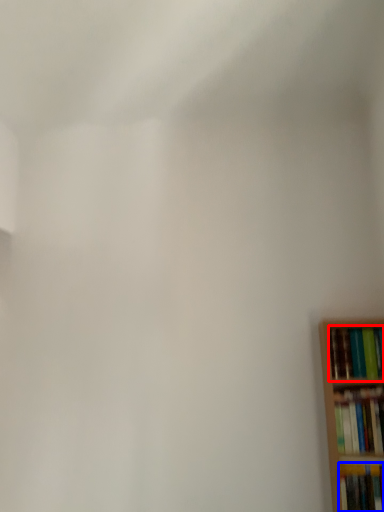
Question: Which point is closer to the camera, book (highlighted by a red box) or book (highlighted by a blue box)?

Choices:
 (A) book
 (B) book

Answer: (B)